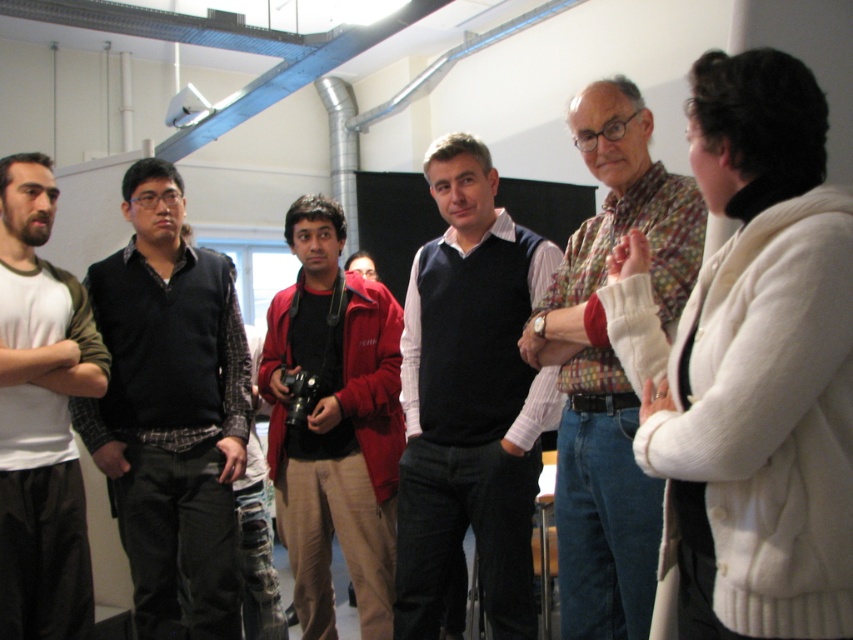
You are organizing a photo shoot and need to ensure that the plaid shirt at left and the red jacket at center are positioned so that neither blocks the other. Based on their current positions, which object should be moved to avoid overlap?

The plaid shirt at left is wider than the red jacket at center, so it should be moved to avoid overlapping the red jacket at center.